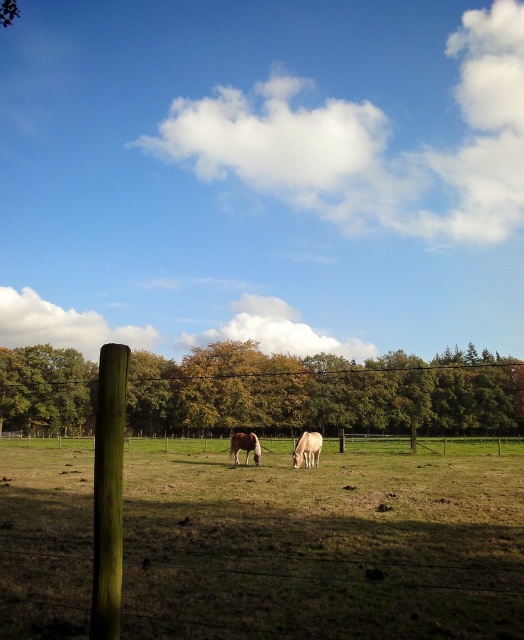
You are standing in the middle of the grassy field enclosed by the wire fence. You see two points marked in the image. Which point is closer to you, point (225, 394) or point (238, 436)?

Point (238, 436) is closer to you because it is less further to the camera than point (225, 394).

You are standing in the field and see the green wood post at left and the green leafy tree at left. Which one is closer to you?

The green wood post at left is closer to you because it is in front of the green leafy tree at left.

You are standing in the middle of the field looking towards the fence. There are two points marked on the fence. Which point is closer to you, point (x=100, y=467) or point (x=16, y=422)?

Point (x=100, y=467) is in front of point (x=16, y=422), so it is closer to you.